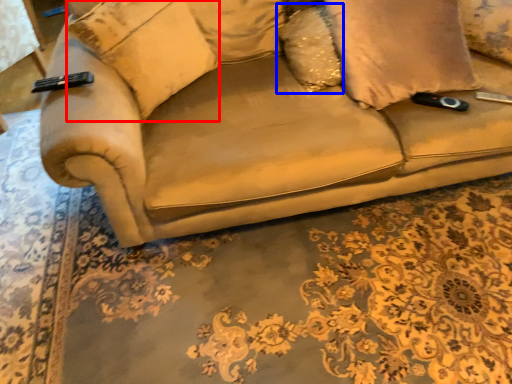
Question: Which object is further to the camera taking this photo, pillow (highlighted by a red box) or pillow (highlighted by a blue box)?

Choices:
 (A) pillow
 (B) pillow

Answer: (B)